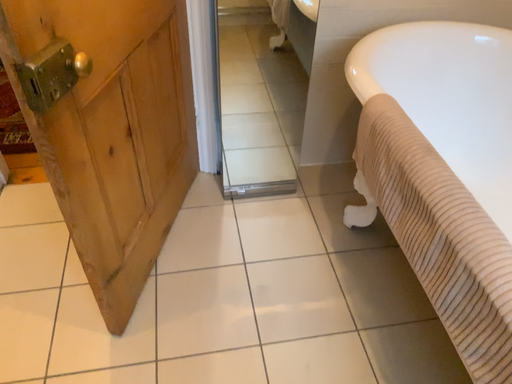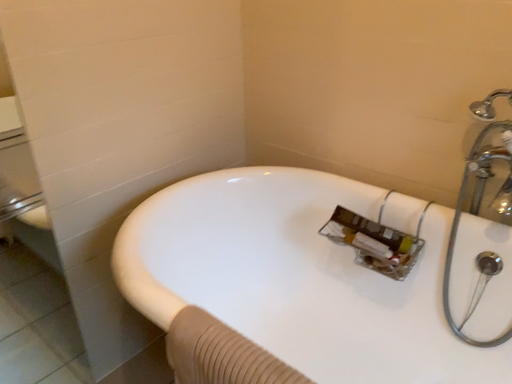
Question: How did the camera likely rotate when shooting the video?

Choices:
 (A) rotated upward
 (B) rotated downward

Answer: (A)